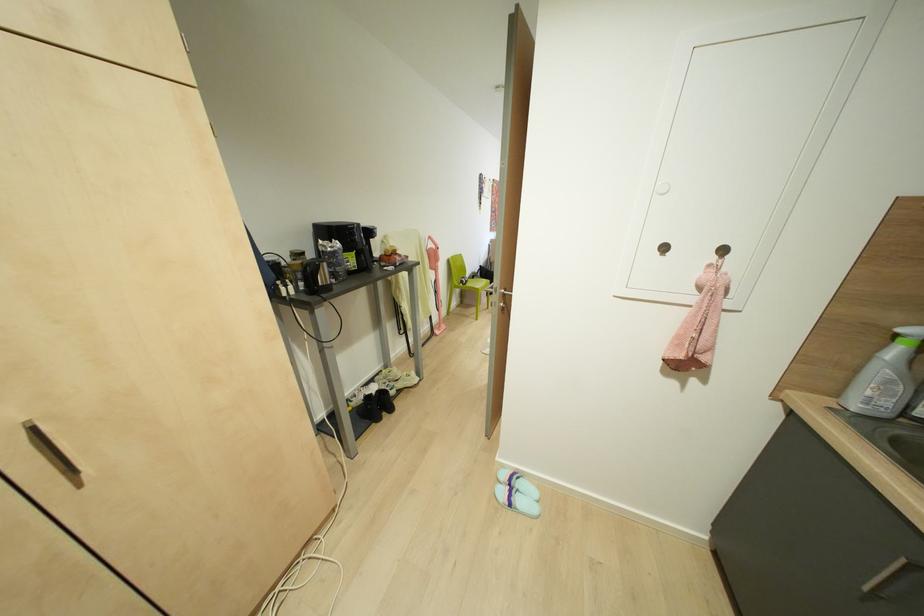
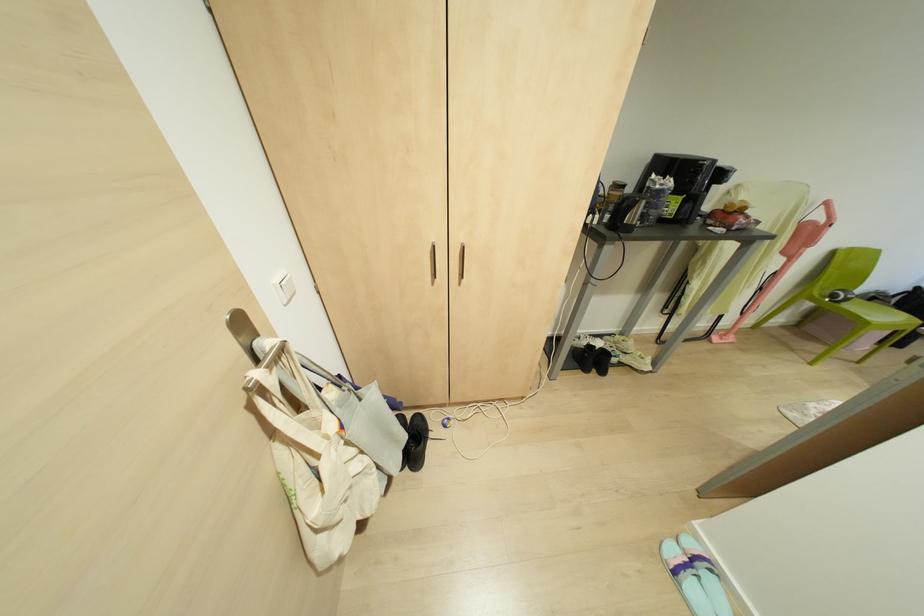
In the second image, find the point that corresponds to point (333, 280) in the first image.

(637, 223)